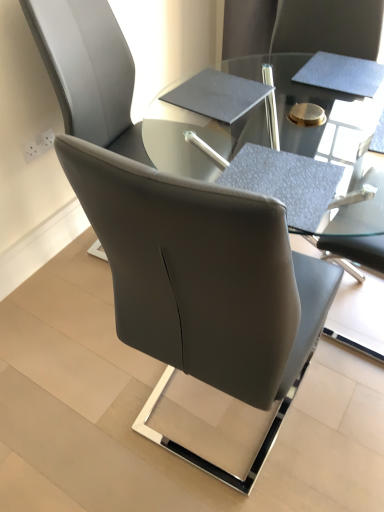
Image resolution: width=384 pixels, height=512 pixels. What are the coordinates of `empty space that is ontop of satin black chair at center (from a real-world perspective)` in the screenshot? It's located at click(x=153, y=391).